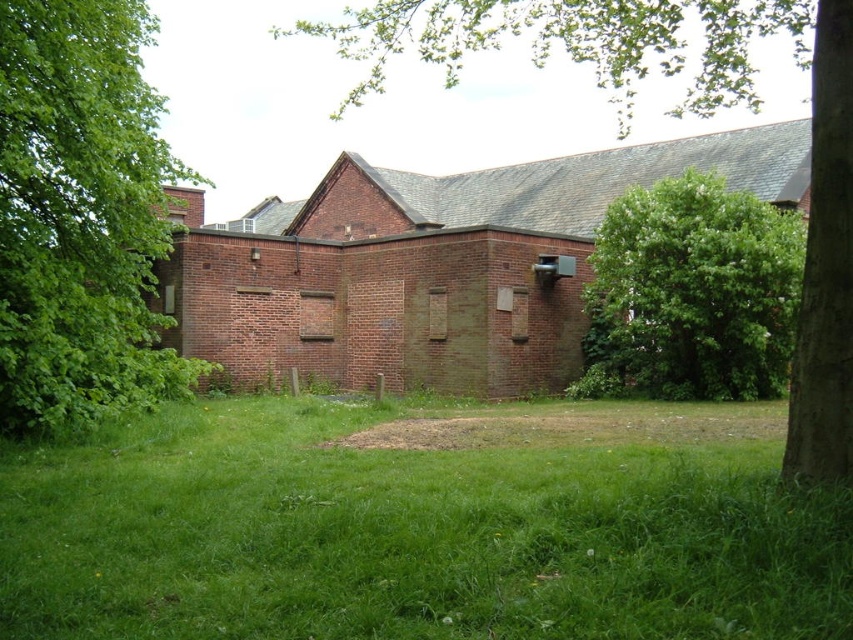
Question: Is green leafy tree at center below green leafy tree at right?

Choices:
 (A) no
 (B) yes

Answer: (A)

Question: Does green leafy tree at center appear on the left side of green leafy tree at right?

Choices:
 (A) no
 (B) yes

Answer: (A)

Question: Which point is closer to the camera?

Choices:
 (A) green leafy tree at center
 (B) green leafy tree at right
 (C) green leafy tree at left

Answer: (A)

Question: Which object is the closest to the green leafy tree at center?

Choices:
 (A) green grass at center
 (B) green leafy tree at right
 (C) green leafy tree at left

Answer: (A)

Question: Where is green grass at center located in relation to green leafy tree at left in the image?

Choices:
 (A) below
 (B) above

Answer: (A)

Question: Which is farther from the green leafy tree at center?

Choices:
 (A) green leafy tree at right
 (B) green grass at center
 (C) green leafy tree at left

Answer: (A)